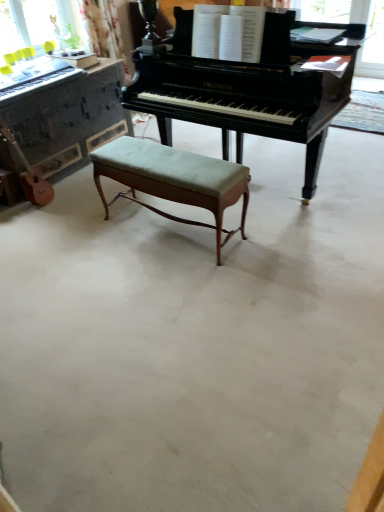
Question: Would you say green fabric stool at center is inside or outside light brown wood guitar at left?

Choices:
 (A) inside
 (B) outside

Answer: (B)

Question: Based on their sizes in the image, would you say green fabric stool at center is bigger or smaller than light brown wood guitar at left?

Choices:
 (A) small
 (B) big

Answer: (B)

Question: Estimate the real-world distances between objects in this image. Which object is closer to the polished dark wood piano at center, the second piano when ordered from right to left?

Choices:
 (A) green fabric stool at center
 (B) light brown wood guitar at left
 (C) matte black keyboard at left
 (D) glossy black piano at center, the first piano positioned from the right

Answer: (C)

Question: Based on their relative distances, which object is farther from the light brown wood guitar at left?

Choices:
 (A) glossy black piano at center, marked as the second piano in a left-to-right arrangement
 (B) matte black keyboard at left
 (C) polished dark wood piano at center, which is the first piano from left to right
 (D) green fabric stool at center

Answer: (A)